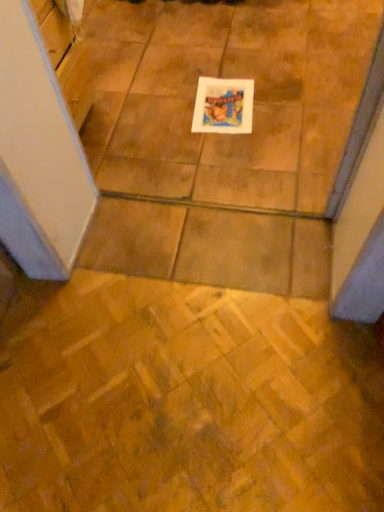
Question: Does white paper at center have a lesser width compared to wooden parquet floor at center?

Choices:
 (A) yes
 (B) no

Answer: (A)

Question: Is white paper at center to the right of wooden parquet floor at center from the viewer's perspective?

Choices:
 (A) no
 (B) yes

Answer: (B)

Question: Could you tell me if white paper at center is turned towards wooden parquet floor at center?

Choices:
 (A) no
 (B) yes

Answer: (A)

Question: From a real-world perspective, is white paper at center below wooden parquet floor at center?

Choices:
 (A) yes
 (B) no

Answer: (A)

Question: Can you confirm if white paper at center is positioned to the left of wooden parquet floor at center?

Choices:
 (A) no
 (B) yes

Answer: (A)

Question: Is wooden parquet floor at center at the back of white paper at center?

Choices:
 (A) yes
 (B) no

Answer: (A)

Question: Could white paper at center be considered to be inside wooden parquet floor at center?

Choices:
 (A) yes
 (B) no

Answer: (B)

Question: From the image's perspective, is wooden parquet floor at center above white paper at center?

Choices:
 (A) yes
 (B) no

Answer: (B)

Question: Does wooden parquet floor at center appear on the right side of white paper at center?

Choices:
 (A) yes
 (B) no

Answer: (B)

Question: Is wooden parquet floor at center wider than white paper at center?

Choices:
 (A) no
 (B) yes

Answer: (B)

Question: Considering the relative sizes of wooden parquet floor at center and white paper at center in the image provided, is wooden parquet floor at center smaller than white paper at center?

Choices:
 (A) no
 (B) yes

Answer: (A)

Question: Considering the relative sizes of wooden parquet floor at center and white paper at center in the image provided, is wooden parquet floor at center shorter than white paper at center?

Choices:
 (A) no
 (B) yes

Answer: (A)

Question: Relative to wooden parquet floor at center, is white paper at center in front or behind?

Choices:
 (A) front
 (B) behind

Answer: (B)